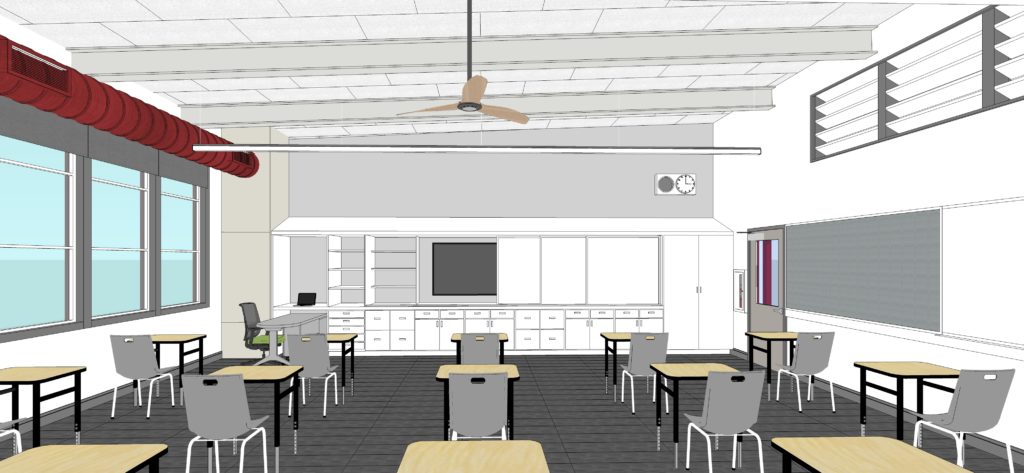
In order to click on floor in this screenshot , I will do `click(389, 432)`, `click(387, 379)`, `click(157, 428)`, `click(590, 419)`, `click(586, 383)`, `click(593, 465)`.